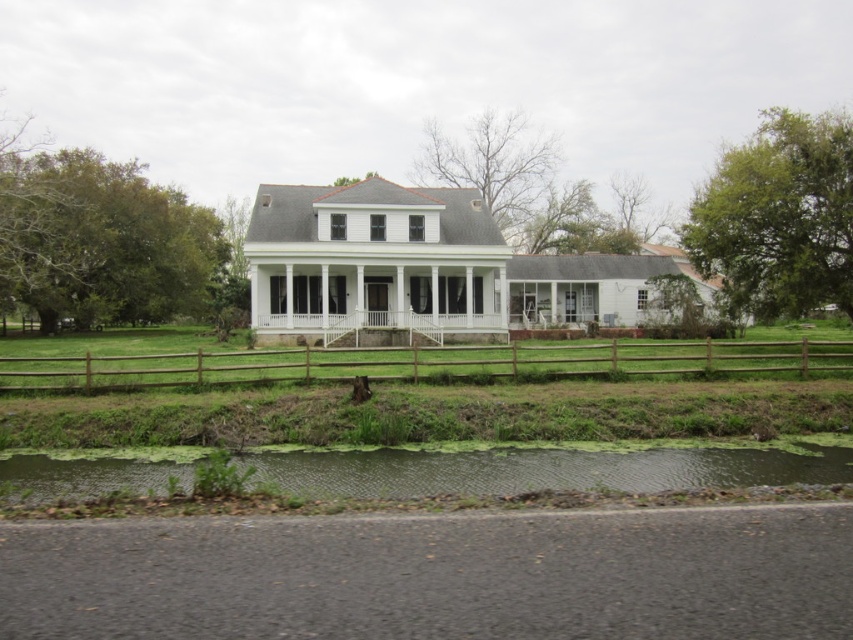
I want to click on green algae-covered pond at lower center, so click(538, 470).

Who is lower down, green algae-covered pond at lower center or brown wooden fence at center?

Positioned lower is green algae-covered pond at lower center.

Where is `green algae-covered pond at lower center`? green algae-covered pond at lower center is located at coordinates (538, 470).